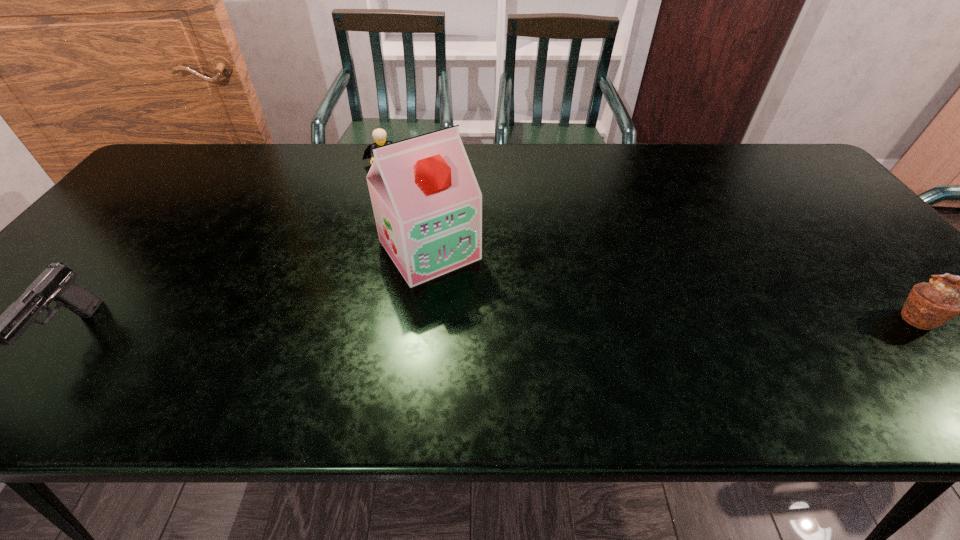
In the image, there is a desktop. At what (x,y) coordinates should I click in order to perform the action: click on vacant region at the near edge. Please return your answer as a coordinate pair (x, y). Image resolution: width=960 pixels, height=540 pixels. Looking at the image, I should click on (391, 346).

What are the coordinates of `vacant space at the left edge of the desktop` in the screenshot? It's located at (131, 231).

Identify the location of free space at the right edge. Image resolution: width=960 pixels, height=540 pixels. (805, 194).

This screenshot has width=960, height=540. What are the coordinates of `vacant space at the near right corner` in the screenshot? It's located at (905, 327).

I want to click on unoccupied area between the pistol and the muffin, so click(x=494, y=326).

Image resolution: width=960 pixels, height=540 pixels. I want to click on vacant space that's between the muffin and the Lego, so click(x=649, y=241).

The width and height of the screenshot is (960, 540). I want to click on vacant point located between the farthest object and the muffin, so click(649, 241).

Find the location of a particular element. This screenshot has width=960, height=540. vacant point located between the farthest object and the leftmost object is located at coordinates (227, 249).

Find the location of a particular element. empty space between the muffin and the Lego is located at coordinates (649, 241).

Image resolution: width=960 pixels, height=540 pixels. What are the coordinates of `free space between the rightmost object and the soya milk` in the screenshot? It's located at (673, 284).